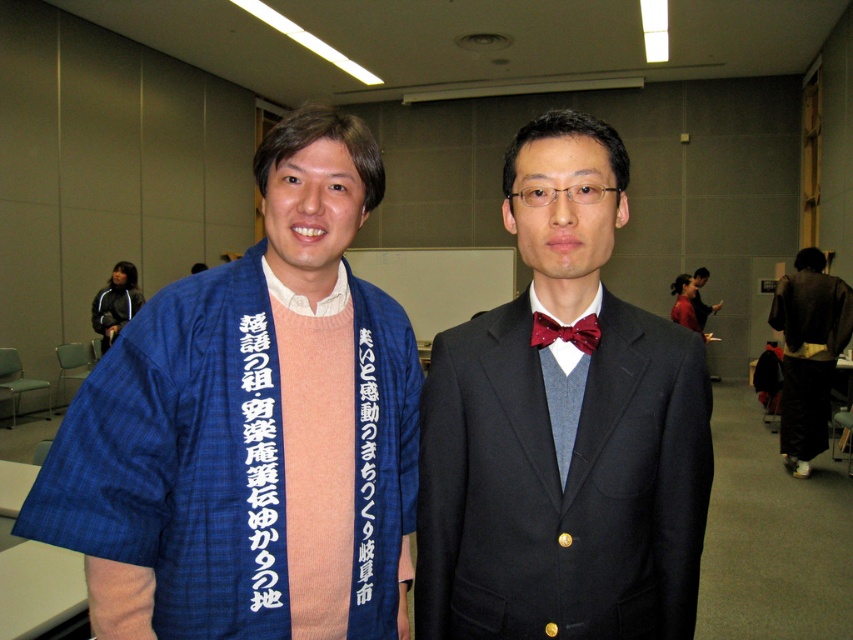
Question: Can you confirm if shiny black suit at center is bigger than brown kimono at right?

Choices:
 (A) no
 (B) yes

Answer: (A)

Question: Which point is closer to the camera?

Choices:
 (A) (695, 296)
 (B) (351, 636)
 (C) (518, 461)
 (D) (804, 422)

Answer: (C)

Question: Is brown kimono at right to the right of dark gray suit at center from the viewer's perspective?

Choices:
 (A) yes
 (B) no

Answer: (B)

Question: Which point is closer to the camera taking this photo?

Choices:
 (A) (123, 356)
 (B) (579, 276)

Answer: (A)

Question: Considering the real-world distances, which object is farthest from the shiny black suit at center?

Choices:
 (A) dark gray suit at center
 (B) blue plaid kimono at left
 (C) shiny red bow tie at center
 (D) brown kimono at right

Answer: (A)

Question: Does blue plaid kimono at left lie behind shiny red bow tie at center?

Choices:
 (A) yes
 (B) no

Answer: (B)